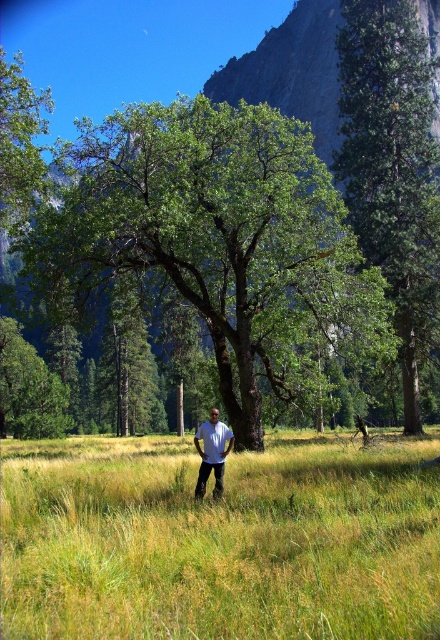
Question: Which of these objects is positioned farthest from the green leafy tree at center?

Choices:
 (A) green grass at center
 (B) green rough bark tree at center
 (C) white cotton shirt at center

Answer: (C)

Question: Which point is closer to the camera?

Choices:
 (A) white cotton shirt at center
 (B) green rough bark tree at center

Answer: (A)

Question: Can you confirm if green leafy tree at center is positioned above white cotton shirt at center?

Choices:
 (A) yes
 (B) no

Answer: (A)

Question: Which of the following is the closest to the observer?

Choices:
 (A) green leafy tree at center
 (B) green grass at center

Answer: (B)

Question: Does green rough bark tree at center have a lesser width compared to white cotton shirt at center?

Choices:
 (A) yes
 (B) no

Answer: (B)

Question: Can you confirm if green leafy tree at center is positioned to the right of white cotton shirt at center?

Choices:
 (A) no
 (B) yes

Answer: (A)